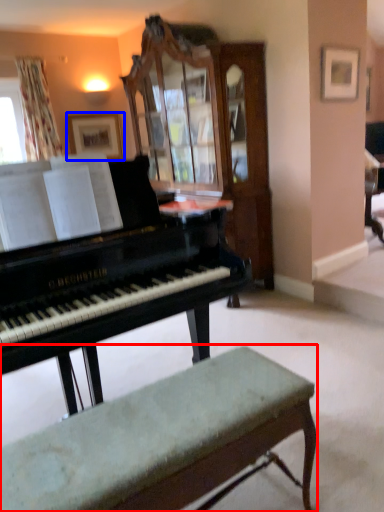
Question: Among these objects, which one is nearest to the camera, bench (highlighted by a red box) or picture frame (highlighted by a blue box)?

Choices:
 (A) bench
 (B) picture frame

Answer: (A)